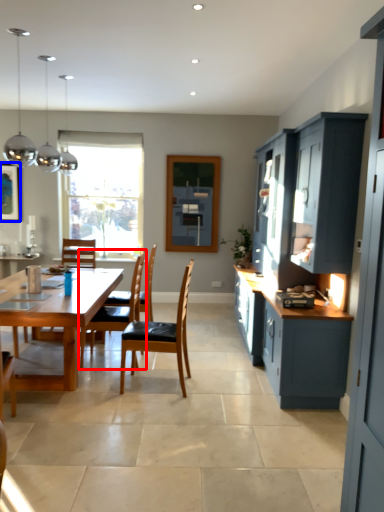
Question: Which of the following is the farthest to the observer, chair (highlighted by a red box) or picture frame (highlighted by a blue box)?

Choices:
 (A) chair
 (B) picture frame

Answer: (B)